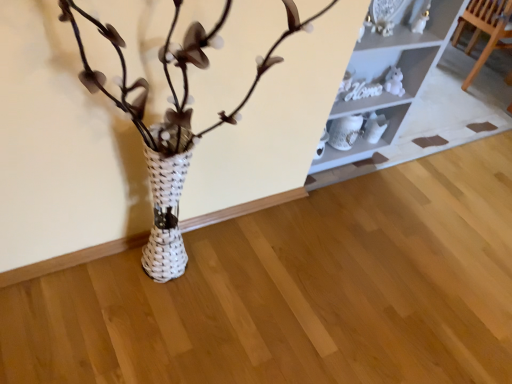
The width and height of the screenshot is (512, 384). What are the coordinates of `white glossy shelf at upper center` in the screenshot? It's located at (389, 70).

The height and width of the screenshot is (384, 512). What do you see at coordinates (389, 70) in the screenshot?
I see `white glossy shelf at upper center` at bounding box center [389, 70].

In order to face white glossy shelf at upper center, should I rotate leftwards or rightwards?

Rotate your view right by about 12.156°.

This screenshot has width=512, height=384. What do you see at coordinates (485, 29) in the screenshot? I see `wooden chair at upper right` at bounding box center [485, 29].

In order to click on wooden chair at upper right in this screenshot , I will do `click(485, 29)`.

At what (x,y) coordinates should I click in order to perform the action: click on white glossy shelf at upper center. Please return your answer as a coordinate pair (x, y). The height and width of the screenshot is (384, 512). Looking at the image, I should click on (389, 70).

Which is more to the right, wooden chair at upper right or white glossy shelf at upper center?

wooden chair at upper right.

In the image, is wooden chair at upper right positioned in front of or behind white glossy shelf at upper center?

Visually, wooden chair at upper right is located behind white glossy shelf at upper center.

Which is in front, point (474, 70) or point (403, 17)?

The point (403, 17) is closer to the camera.

From the image's perspective, is wooden chair at upper right beneath white glossy shelf at upper center?

No.

From a real-world perspective, is wooden chair at upper right located higher than white glossy shelf at upper center?

Actually, wooden chair at upper right is physically below white glossy shelf at upper center in the real world.

Based on the photo, considering the relative sizes of wooden chair at upper right and white glossy shelf at upper center in the image provided, is wooden chair at upper right thinner than white glossy shelf at upper center?

Correct, the width of wooden chair at upper right is less than that of white glossy shelf at upper center.

Which of these two, wooden chair at upper right or white glossy shelf at upper center, stands taller?

Standing taller between the two is white glossy shelf at upper center.

Considering the relative sizes of wooden chair at upper right and white glossy shelf at upper center in the image provided, is wooden chair at upper right bigger than white glossy shelf at upper center?

No.

Could white glossy shelf at upper center be considered to be inside wooden chair at upper right?

No, white glossy shelf at upper center is not a part of wooden chair at upper right.

Looking at this image, are wooden chair at upper right and white glossy shelf at upper center beside each other?

No, wooden chair at upper right is not making contact with white glossy shelf at upper center.

Is wooden chair at upper right turned away from white glossy shelf at upper center?

Yes, wooden chair at upper right is facing away from white glossy shelf at upper center.

You are a GUI agent. You are given a task and a screenshot of the screen. Output one action in this format:
    pyautogui.click(x=<x>, y=<y>)
    Task: Click on the shelf that is on the left side of wooden chair at upper right
    The height and width of the screenshot is (384, 512).
    Given the screenshot: What is the action you would take?
    pyautogui.click(x=389, y=70)

Does white glossy shelf at upper center appear on the right side of wooden chair at upper right?

In fact, white glossy shelf at upper center is to the left of wooden chair at upper right.

In the scene shown: Which object is further away from the camera taking this photo, white glossy shelf at upper center or wooden chair at upper right?

wooden chair at upper right is more distant.

Is point (360, 103) more distant than point (475, 43)?

No, it is not.

From the image's perspective, which one is positioned higher, white glossy shelf at upper center or wooden chair at upper right?

wooden chair at upper right.

From a real-world perspective, is white glossy shelf at upper center above or below wooden chair at upper right?

white glossy shelf at upper center is above wooden chair at upper right.

Consider the image. Can you confirm if white glossy shelf at upper center is thinner than wooden chair at upper right?

Incorrect, the width of white glossy shelf at upper center is not less than that of wooden chair at upper right.

Can you confirm if white glossy shelf at upper center is shorter than wooden chair at upper right?

Incorrect, the height of white glossy shelf at upper center does not fall short of that of wooden chair at upper right.

Who is smaller, white glossy shelf at upper center or wooden chair at upper right?

Smaller between the two is wooden chair at upper right.

Is white glossy shelf at upper center not inside wooden chair at upper right?

Yes.

Is there a large distance between white glossy shelf at upper center and wooden chair at upper right?

Yes, white glossy shelf at upper center and wooden chair at upper right are located far from each other.

Is white glossy shelf at upper center oriented towards wooden chair at upper right?

Yes, white glossy shelf at upper center faces towards wooden chair at upper right.

Can you tell me how much white glossy shelf at upper center and wooden chair at upper right differ in facing direction?

The facing directions of white glossy shelf at upper center and wooden chair at upper right are 0.359 degrees apart.

At what (x,y) coordinates should I click in order to perform the action: click on shelf above the wooden chair at upper right (from a real-world perspective). Please return your answer as a coordinate pair (x, y). This screenshot has height=384, width=512. Looking at the image, I should click on (389, 70).

Image resolution: width=512 pixels, height=384 pixels. I want to click on furniture beneath the white glossy shelf at upper center (from a real-world perspective), so click(485, 29).

Where is `shelf below the wooden chair at upper right (from the image's perspective)`? Image resolution: width=512 pixels, height=384 pixels. shelf below the wooden chair at upper right (from the image's perspective) is located at coordinates (389, 70).